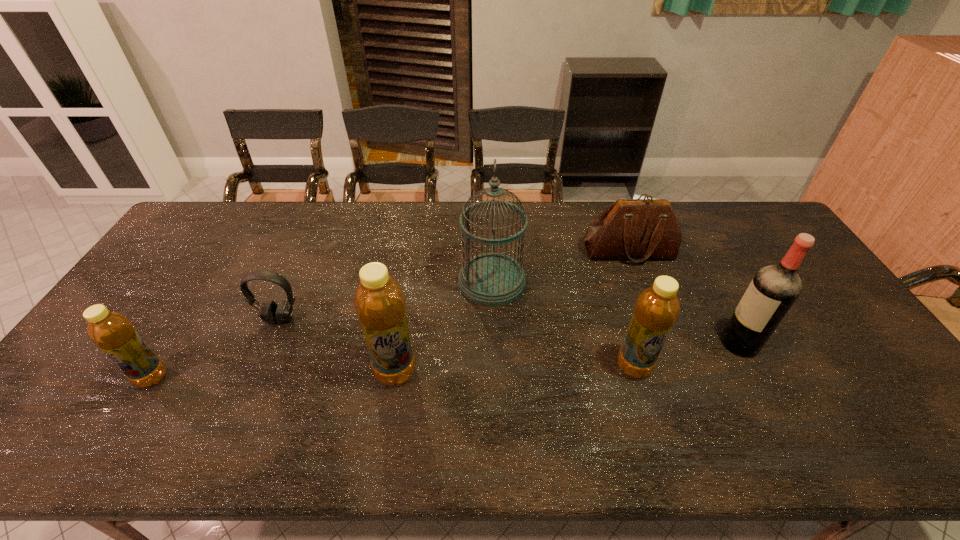
The width and height of the screenshot is (960, 540). Find the location of `the leftmost bottle`. the leftmost bottle is located at coordinates (112, 332).

Where is `the shortest bottle`? This screenshot has width=960, height=540. the shortest bottle is located at coordinates (112, 332).

The image size is (960, 540). Find the location of `the fifth object from right to left`. the fifth object from right to left is located at coordinates (379, 301).

Find the location of a particular element. The height and width of the screenshot is (540, 960). the fourth shortest object is located at coordinates (656, 310).

Identify the location of the rightmost bottle. (656, 310).

The image size is (960, 540). I want to click on shoulder bag, so click(638, 229).

Locate an element on the screen. liquor is located at coordinates (774, 289).

At what (x,y) coordinates should I click in order to perform the action: click on the fourth object from left to right. Please return your answer as a coordinate pair (x, y). The width and height of the screenshot is (960, 540). Looking at the image, I should click on 492,279.

Where is `headset`? The height and width of the screenshot is (540, 960). headset is located at coordinates (272, 313).

Locate an element on the screen. The width and height of the screenshot is (960, 540). the shortest object is located at coordinates (272, 313).